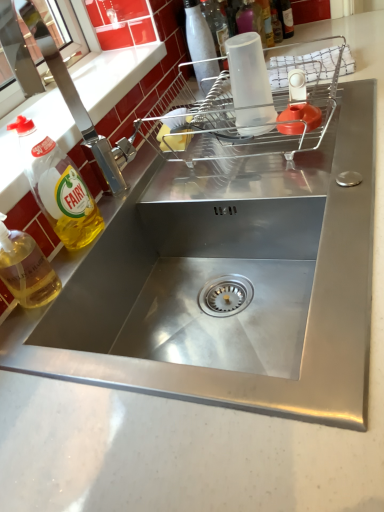
Question: In terms of width, does yellow translucent liquid at left, positioned as the fourth bottle in right-to-left order, look wider or thinner when compared to clear plastic dish rack at upper center?

Choices:
 (A) wide
 (B) thin

Answer: (B)

Question: Considering the positions of yellow translucent liquid at left, the 2th bottle from the left, and clear plastic dish rack at upper center in the image, is yellow translucent liquid at left, the 2th bottle from the left, bigger or smaller than clear plastic dish rack at upper center?

Choices:
 (A) small
 (B) big

Answer: (A)

Question: Estimate the real-world distances between objects in this image. Which object is farther from the brushed metal tap at left?

Choices:
 (A) white glossy bottle at upper center, which appears as the third bottle when viewed from the front
 (B) translucent plastic bottle at upper right, which is the 5th bottle in front-to-back order
 (C) yellow translucent liquid at left, the 2th bottle from the front
 (D) clear plastic dish rack at upper center
 (E) transparent plastic cup at upper center, the 2th bottle from the right

Answer: (B)

Question: Estimate the real-world distances between objects in this image. Which object is farther from the white glossy bottle at upper center, the 3th bottle in the back-to-front sequence?

Choices:
 (A) brushed metal tap at left
 (B) yellow translucent liquid at left, the second bottle positioned from the bottom
 (C) clear plastic dish rack at upper center
 (D) yellow translucent liquid at left, which appears as the 1th bottle when viewed from the front
 (E) translucent plastic bottle at upper right, the 1th bottle from the right

Answer: (D)